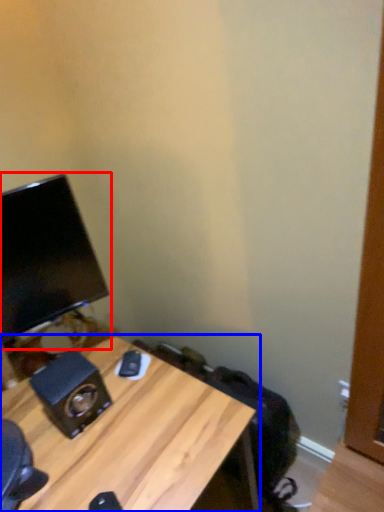
Question: Which of the following is the closest to the observer, computer monitor (highlighted by a red box) or desk (highlighted by a blue box)?

Choices:
 (A) computer monitor
 (B) desk

Answer: (B)